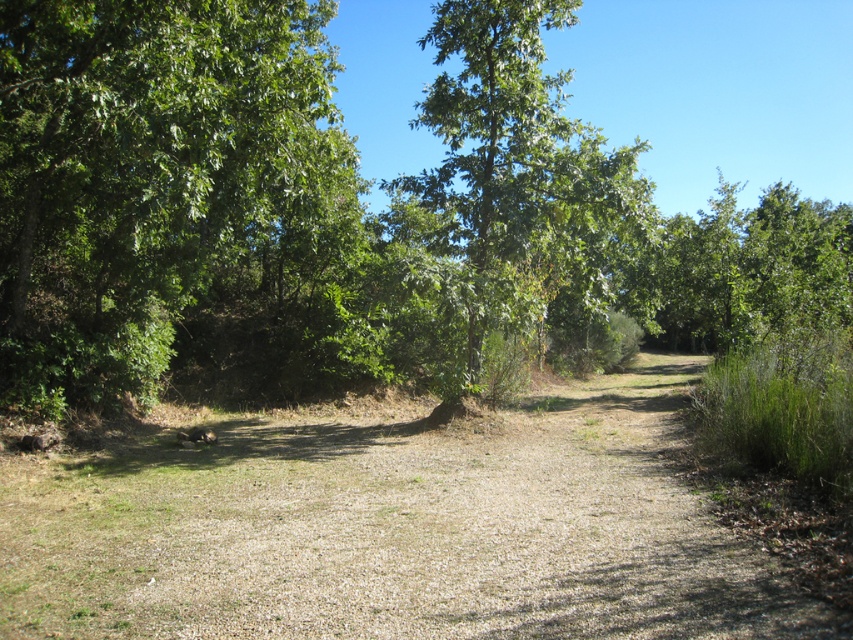
Between green leafy forest at center and green leafy tree at center, which one has less height?

green leafy forest at center is shorter.

Does green leafy forest at center appear under green leafy tree at center?

Yes.

The image size is (853, 640). Describe the element at coordinates (341, 212) in the screenshot. I see `green leafy forest at center` at that location.

Where is `green leafy forest at center`? The image size is (853, 640). green leafy forest at center is located at coordinates (341, 212).

Between green leafy forest at center and green leafy tree at left, which one has less height?

With less height is green leafy tree at left.

Can you confirm if green leafy forest at center is positioned above green leafy tree at left?

Yes, green leafy forest at center is above green leafy tree at left.

This screenshot has height=640, width=853. What do you see at coordinates (341, 212) in the screenshot? I see `green leafy forest at center` at bounding box center [341, 212].

What are the coordinates of `green leafy forest at center` in the screenshot? It's located at (341, 212).

Is green leafy tree at left taller than green leafy tree at center?

Incorrect, green leafy tree at left's height is not larger of green leafy tree at center's.

Between point (175, 125) and point (640, 148), which one is positioned behind?

The point (640, 148) is behind.

Where is `green leafy tree at left`? green leafy tree at left is located at coordinates (155, 179).